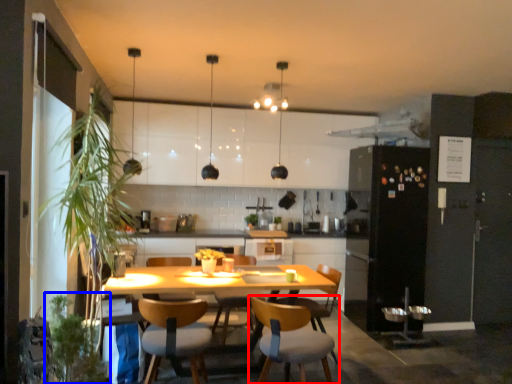
Question: Which point is closer to the camera, chair (highlighted by a red box) or plant (highlighted by a blue box)?

Choices:
 (A) chair
 (B) plant

Answer: (B)